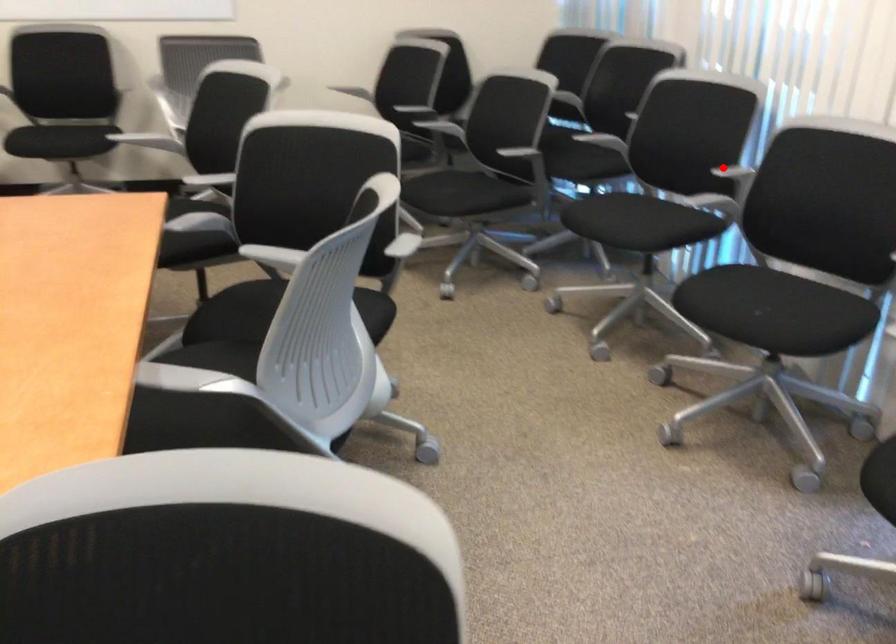
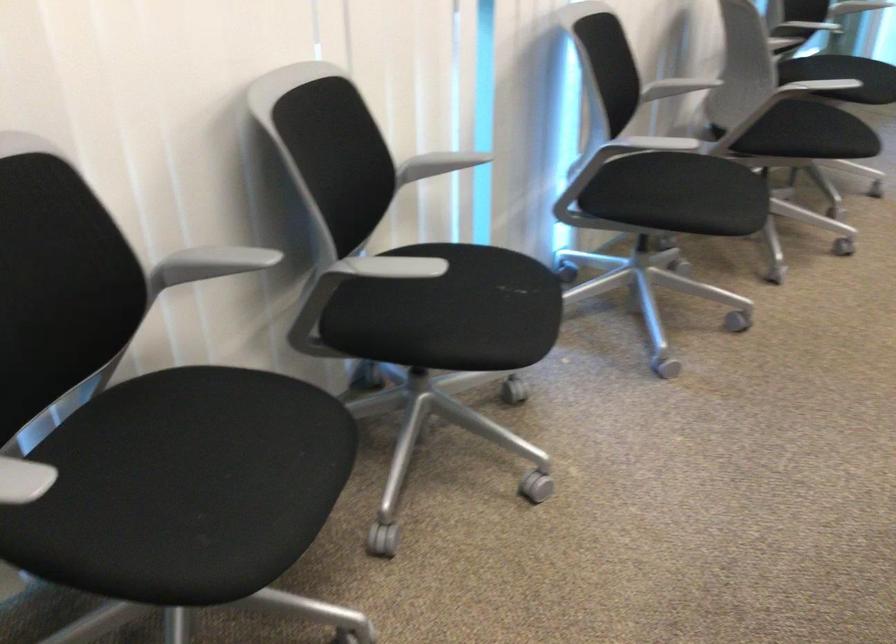
Locate, in the second image, the point that corresponds to the highlighted location in the first image.

(211, 263)